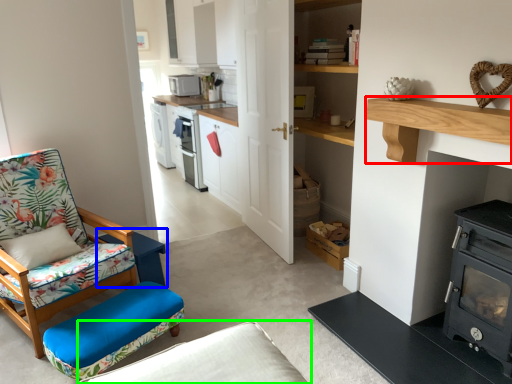
Question: Which object is positioned farthest from shelf (highlighted by a red box)? Select from table (highlighted by a blue box) and studio couch (highlighted by a green box).

Choices:
 (A) table
 (B) studio couch

Answer: (A)